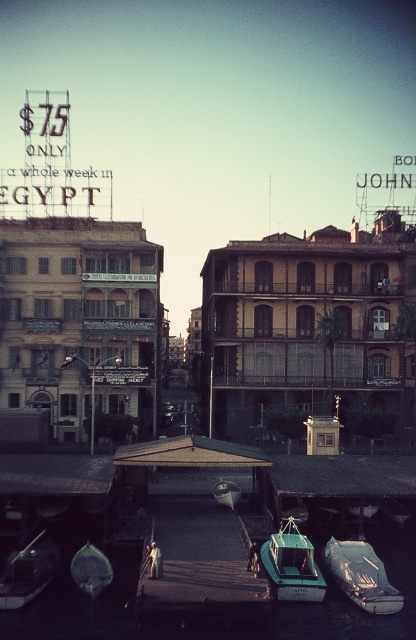
Question: Does metallic green boat at lower center have a greater width compared to teal glossy boat at center?

Choices:
 (A) yes
 (B) no

Answer: (A)

Question: Which of the following is the closest to the observer?

Choices:
 (A) metallic green boat at lower center
 (B) teal matte boat at center
 (C) teal matte boat at lower center

Answer: (B)

Question: Is teal matte boat at lower center positioned in front of metallic green boat at lower center?

Choices:
 (A) yes
 (B) no

Answer: (B)

Question: Among these objects, which one is nearest to the camera?

Choices:
 (A) teal matte boat at center
 (B) teal glossy boat at center
 (C) metallic green boat at lower center
 (D) metallic silver boat at lower left

Answer: (A)

Question: Estimate the real-world distances between objects in this image. Which object is closer to the metallic silver boat at lower left?

Choices:
 (A) teal matte boat at center
 (B) metallic green boat at lower center
 (C) teal glossy boat at center

Answer: (B)

Question: Does metallic silver boat at lower left lie in front of metallic green boat at lower center?

Choices:
 (A) yes
 (B) no

Answer: (B)